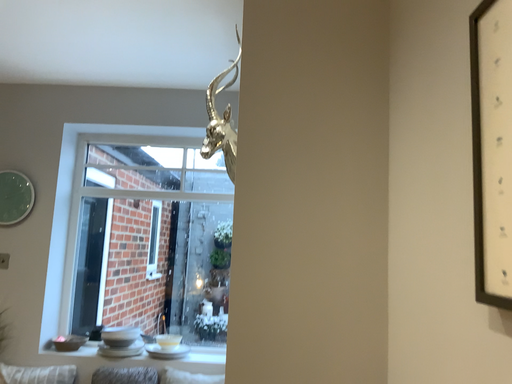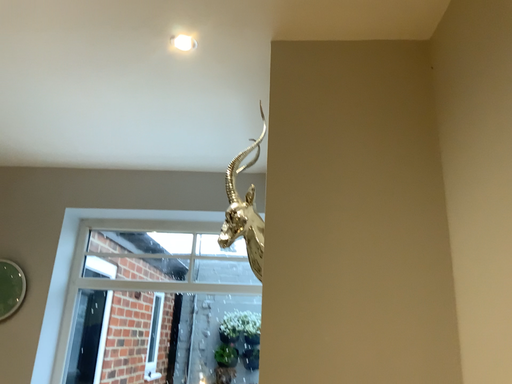
Question: Which way did the camera rotate in the video?

Choices:
 (A) rotated upward
 (B) rotated downward

Answer: (A)